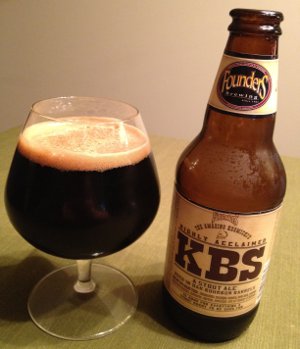
This screenshot has height=349, width=300. I want to click on glass stem, so click(x=83, y=272).